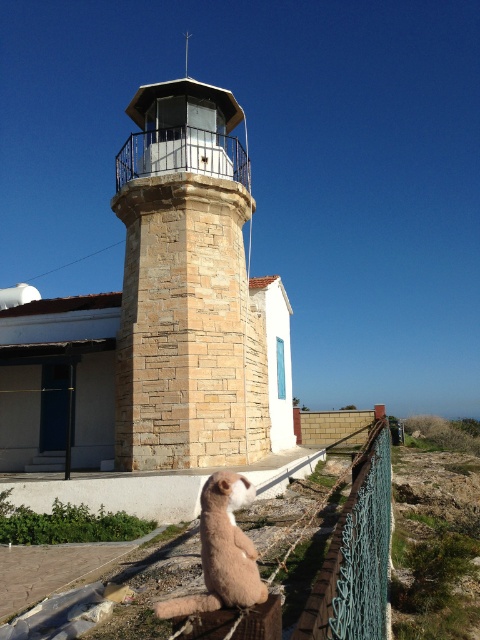
Does point (254, 339) lie behind point (241, 540)?

Yes, it is behind point (241, 540).

Which of these two, stone textured tower at center or fuzzy beige cat at lower center, stands shorter?

fuzzy beige cat at lower center

Is point (216, 342) positioned before point (237, 596)?

No, (216, 342) is behind (237, 596).

You are a GUI agent. You are given a task and a screenshot of the screen. Output one action in this format:
    pyautogui.click(x=<x>, y=<y>)
    Task: Click on the stone textured tower at center
    Image resolution: width=480 pixels, height=640 pixels.
    Given the screenshot: What is the action you would take?
    pyautogui.click(x=187, y=288)

Between green wire mesh at right and fuzzy beige cat at lower center, which one appears on the right side from the viewer's perspective?

Positioned to the right is green wire mesh at right.

Does green wire mesh at right appear over fuzzy beige cat at lower center?

Actually, green wire mesh at right is below fuzzy beige cat at lower center.

The height and width of the screenshot is (640, 480). Describe the element at coordinates (356, 554) in the screenshot. I see `green wire mesh at right` at that location.

Locate an element on the screen. The width and height of the screenshot is (480, 640). green wire mesh at right is located at coordinates (356, 554).

Between stone textured tower at center and green wire mesh at right, which one has less height?

Standing shorter between the two is green wire mesh at right.

Is point (157, 392) positioned behind point (302, 637)?

Yes, point (157, 392) is behind point (302, 637).

Image resolution: width=480 pixels, height=640 pixels. Identify the location of stone textured tower at center. (187, 288).